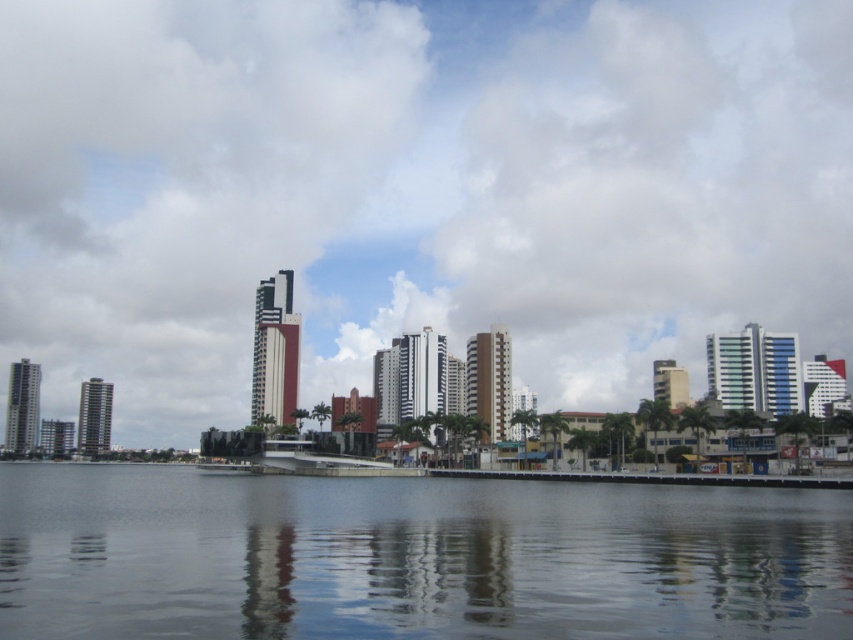
From the picture: You are a photographer planning to capture the waterfront cityscape. You want to ensure that the white fluffy cloud at upper center and the transparent glass water at center are both visible in your shot. Based on their sizes, which object will occupy more space in the photo?

The white fluffy cloud at upper center is larger in size than the transparent glass water at center, so it will occupy more space in the photo.

You are a pilot preparing to land a small plane on the transparent glass water at center. You notice the white fluffy cloud at upper center above you. Is there enough space between the cloud and the water for your plane to land safely?

The white fluffy cloud at upper center is positioned over transparent glass water at center, so there is sufficient vertical space between them for the plane to land safely as clouds are above the water and do not obstruct the landing area.